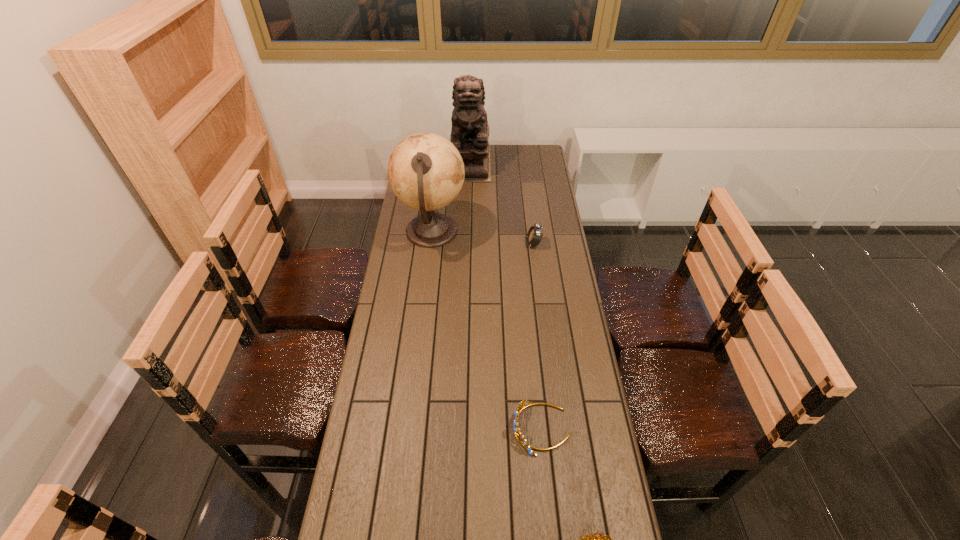
You are a GUI agent. You are given a task and a screenshot of the screen. Output one action in this format:
    pyautogui.click(x=<x>, y=<y>)
    Task: Click on the sculpture
    The height and width of the screenshot is (540, 960).
    Given the screenshot: What is the action you would take?
    pyautogui.click(x=470, y=131)

The width and height of the screenshot is (960, 540). I want to click on globe, so click(x=426, y=172).

At what (x,y) coordinates should I click in order to perform the action: click on alarm clock. Please return your answer as a coordinate pair (x, y). Image resolution: width=960 pixels, height=540 pixels. Looking at the image, I should click on (534, 235).

Where is `the farther tiara`? This screenshot has width=960, height=540. the farther tiara is located at coordinates (524, 403).

At what (x,y) coordinates should I click in order to perform the action: click on the fourth farthest object. Please return your answer as a coordinate pair (x, y). The height and width of the screenshot is (540, 960). Looking at the image, I should click on (524, 403).

Find the location of a particular element. The image size is (960, 540). free space located 0.140m on the front-facing side of the farthest object is located at coordinates (469, 198).

Locate an element on the screen. vacant space located 0.320m on the front-facing side of the globe is located at coordinates (538, 232).

The height and width of the screenshot is (540, 960). What are the coordinates of `free location located on the face of the alarm clock` in the screenshot? It's located at (512, 244).

This screenshot has width=960, height=540. I want to click on blank space located 0.260m on the face of the alarm clock, so click(x=466, y=244).

You are a GUI agent. You are given a task and a screenshot of the screen. Output one action in this format:
    pyautogui.click(x=<x>, y=<y>)
    Task: Click on the vacant space located on the face of the alarm clock
    The height and width of the screenshot is (540, 960).
    Given the screenshot: What is the action you would take?
    pyautogui.click(x=484, y=244)